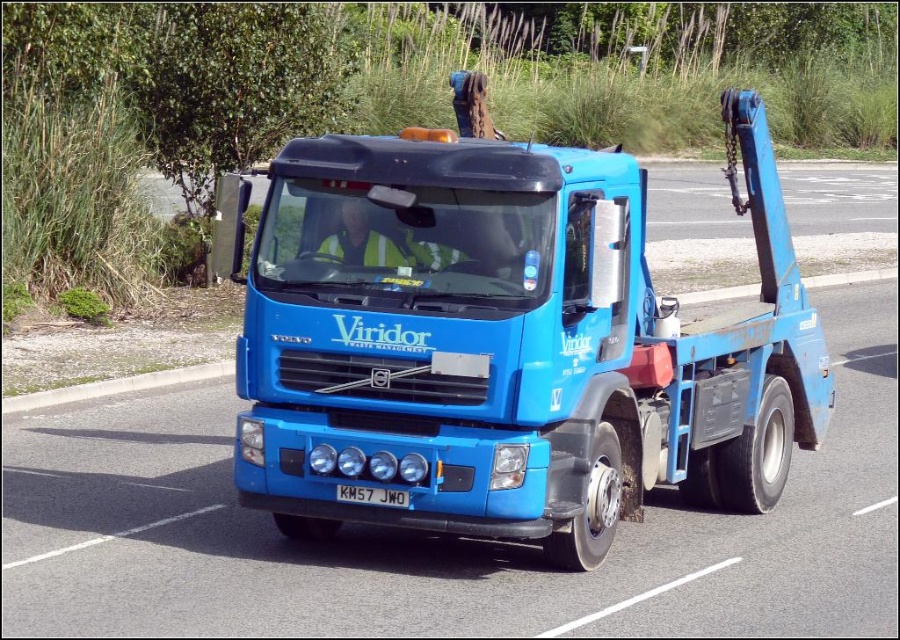
Question: Can you confirm if blue matte tow truck at center is wider than blue metallic truck at center?

Choices:
 (A) no
 (B) yes

Answer: (A)

Question: Which object is the closest to the blue matte tow truck at center?

Choices:
 (A) blue metallic truck at center
 (B) black metal/license plate at center

Answer: (B)

Question: Does blue metallic truck at center have a larger size compared to black metal/license plate at center?

Choices:
 (A) no
 (B) yes

Answer: (B)

Question: Which point is farther to the camera?

Choices:
 (A) black metal/license plate at center
 (B) blue metallic truck at center
 (C) blue matte tow truck at center

Answer: (C)

Question: Which of the following is the farthest from the observer?

Choices:
 (A) (383, 497)
 (B) (846, 432)

Answer: (B)

Question: Considering the relative positions of blue metallic truck at center and black metal/license plate at center in the image provided, where is blue metallic truck at center located with respect to black metal/license plate at center?

Choices:
 (A) above
 (B) below

Answer: (B)